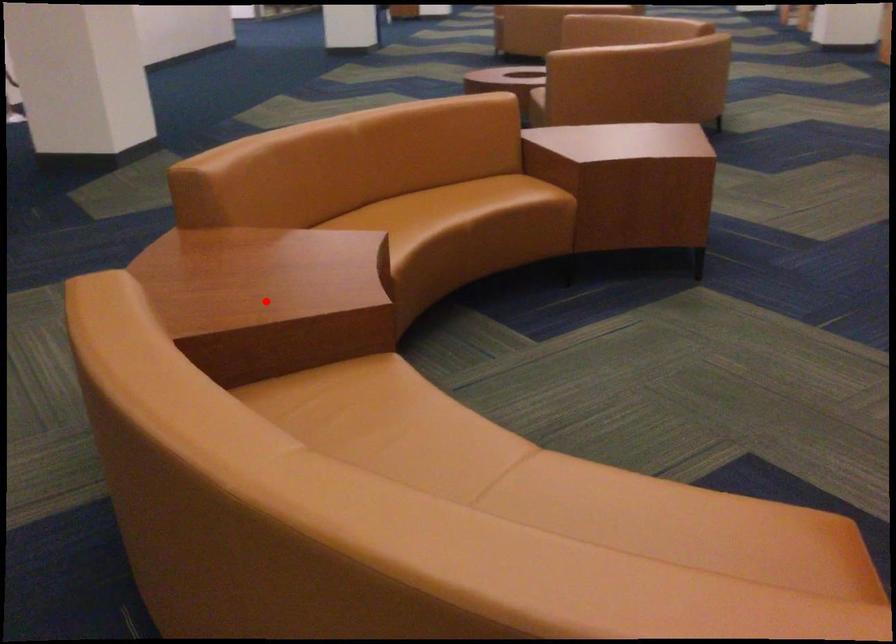
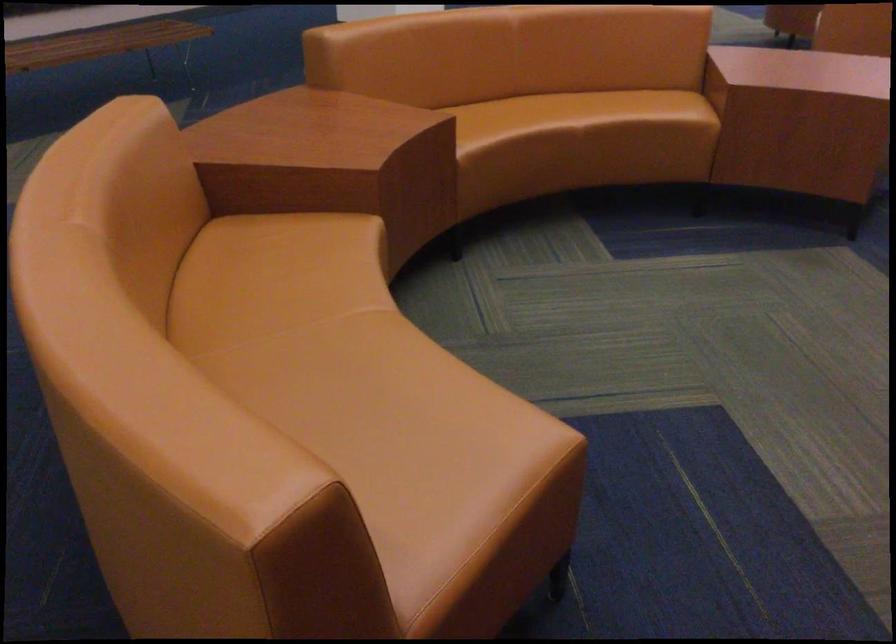
Question: I am providing you with two images of the same scene from different viewpoints. Given a red point in image1, look at the same physical point in image2. Is it:

Choices:
 (A) Closer to the viewpoint
 (B) Farther from the viewpoint

Answer: (B)